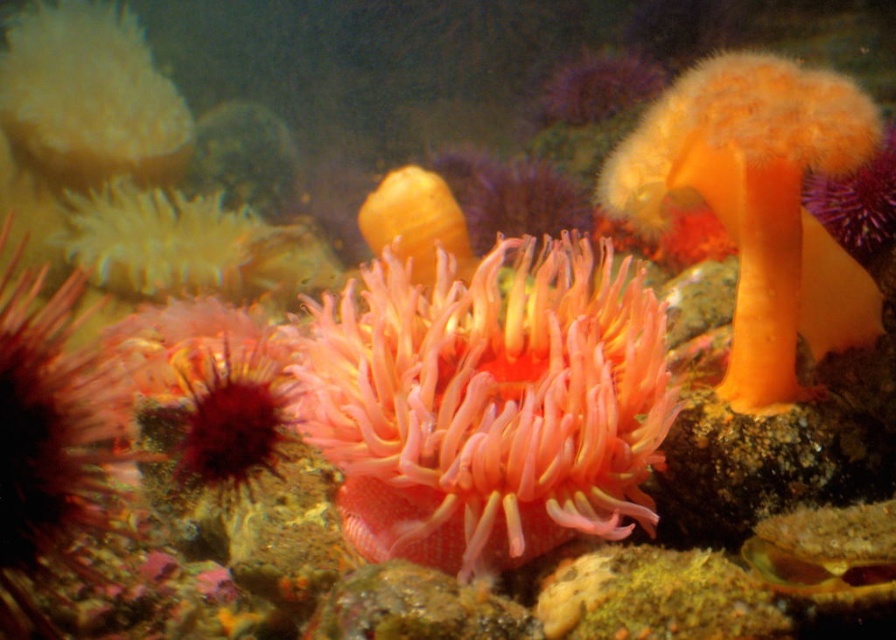
Describe the element at coordinates (757, 204) in the screenshot. I see `orange soft coral at upper right` at that location.

Is orange soft coral at upper right smaller than yellow rubber duck at center?

Incorrect, orange soft coral at upper right is not smaller in size than yellow rubber duck at center.

Measure the distance between point (694, 186) and camera.

4.54 feet

Locate an element on the screen. orange soft coral at upper right is located at coordinates (x=757, y=204).

Between pink soft coral at center and yellow rubber duck at center, which one is positioned higher?

Positioned higher is yellow rubber duck at center.

Can you confirm if pink soft coral at center is smaller than yellow rubber duck at center?

Actually, pink soft coral at center might be larger than yellow rubber duck at center.

You are a GUI agent. You are given a task and a screenshot of the screen. Output one action in this format:
    pyautogui.click(x=<x>, y=<y>)
    Task: Click on the pink soft coral at center
    
    Given the screenshot: What is the action you would take?
    pyautogui.click(x=488, y=403)

What do you see at coordinates (488, 403) in the screenshot? Image resolution: width=896 pixels, height=640 pixels. I see `pink soft coral at center` at bounding box center [488, 403].

Who is more distant from viewer, (444, 404) or (855, 140)?

The point (444, 404) is behind.

You are a GUI agent. You are given a task and a screenshot of the screen. Output one action in this format:
    pyautogui.click(x=<x>, y=<y>)
    Task: Click on the pink soft coral at center
    
    Given the screenshot: What is the action you would take?
    pyautogui.click(x=488, y=403)